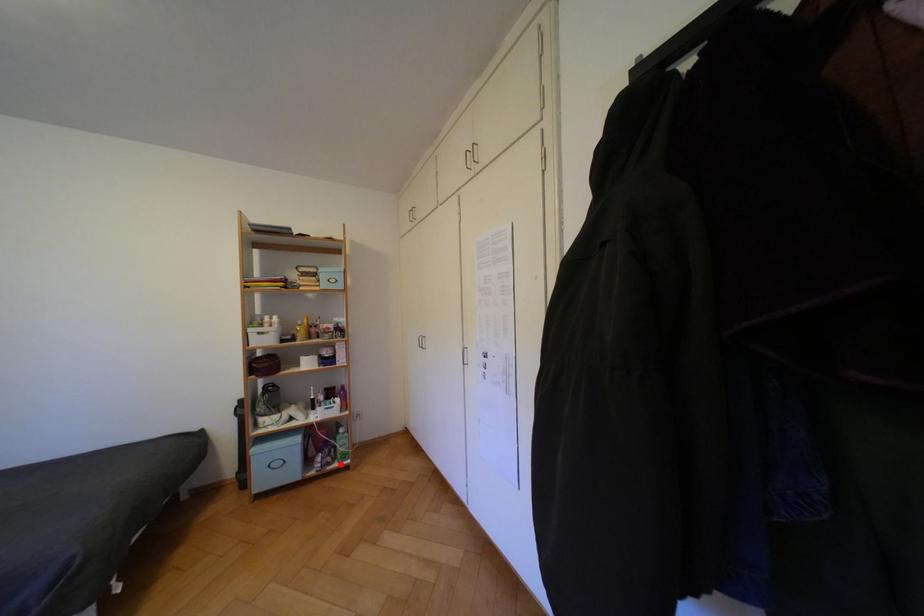
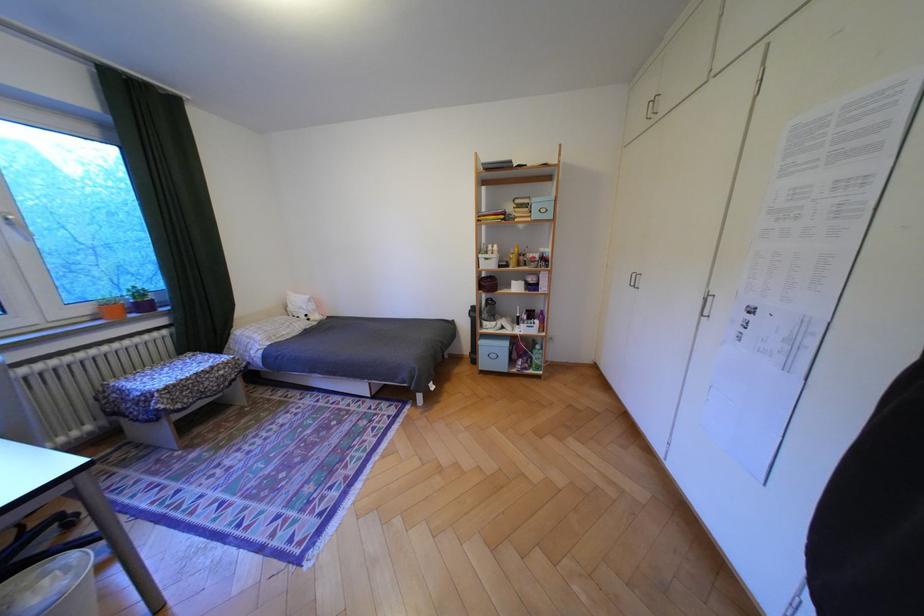
Where in the second image is the point corresponding to the highlighted location from the first image?

(538, 369)